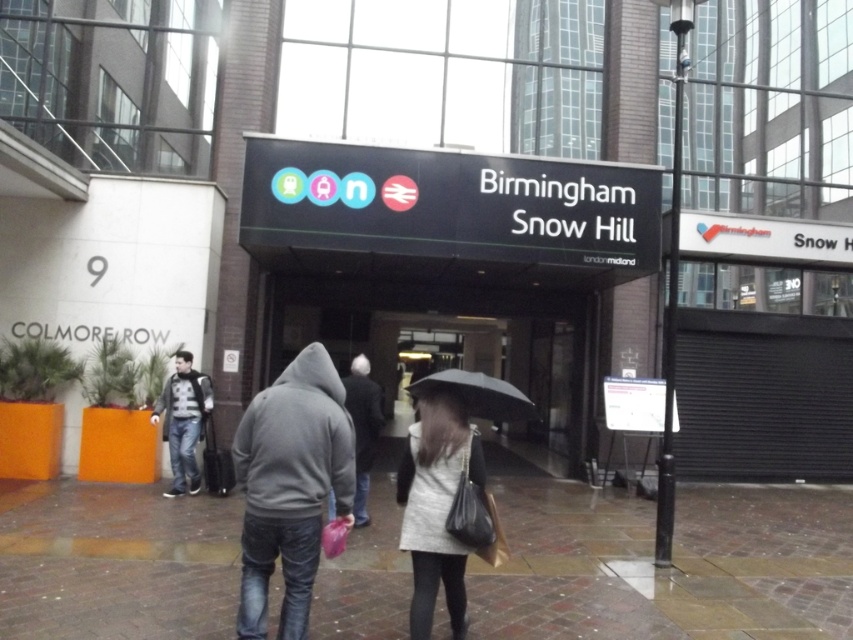
You are standing at the entrance of Birmingham Snow Hill station and notice a dark gray hoodie at center and a brick pavement at lower center. Which object is closer to your right side?

The brick pavement at lower center is positioned on the right side of dark gray hoodie at center, so it is closer to your right side.

You are standing at the entrance of Birmingham Snow Hill station and see the brick pavement at lower center and the denim jacket at center. Which object takes up more space in the image?

The brick pavement at lower center has a larger size compared to the denim jacket at center, so it takes up more space in the image.